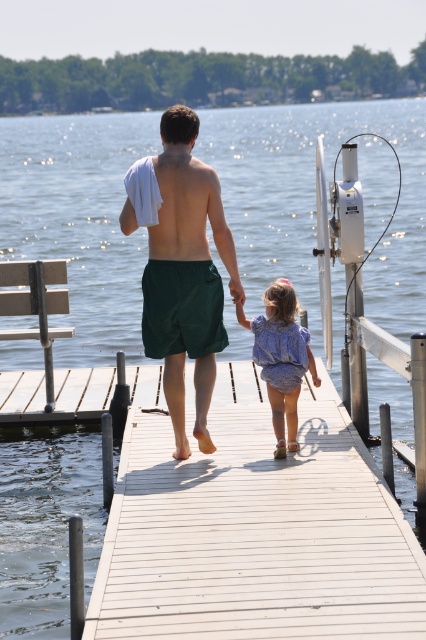
Question: Is white wooden dock at center above blue cotton dress at center?

Choices:
 (A) no
 (B) yes

Answer: (A)

Question: Based on their relative distances, which object is farther from the blue cotton dress at center?

Choices:
 (A) white wooden dock at center
 (B) green fabric shorts at center

Answer: (A)

Question: Which of the following is the closest to the observer?

Choices:
 (A) green fabric shorts at center
 (B) white wooden dock at center

Answer: (B)

Question: Does green fabric shorts at center have a greater width compared to blue cotton dress at center?

Choices:
 (A) yes
 (B) no

Answer: (A)

Question: Which object appears closest to the camera in this image?

Choices:
 (A) white wooden dock at center
 (B) green fabric shorts at center

Answer: (A)

Question: Can you confirm if white wooden dock at center is smaller than blue cotton dress at center?

Choices:
 (A) yes
 (B) no

Answer: (B)